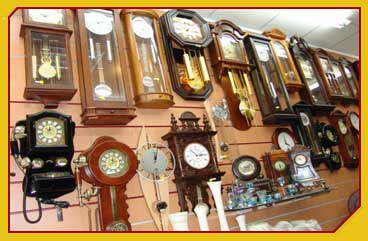
This screenshot has height=241, width=368. Identify the location of dark brown wooden clock. (206, 139).